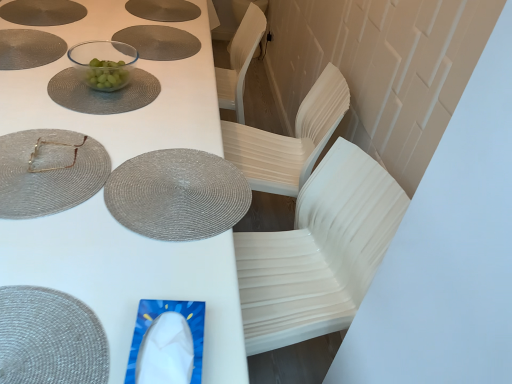
What are the coordinates of `vacant space in between silver textured placemat at center, which is counted as the 2th tableware, starting from the bottom, and matte gray placemat at upper center, which appears as the 2th plate when viewed from the left` in the screenshot? It's located at (167, 97).